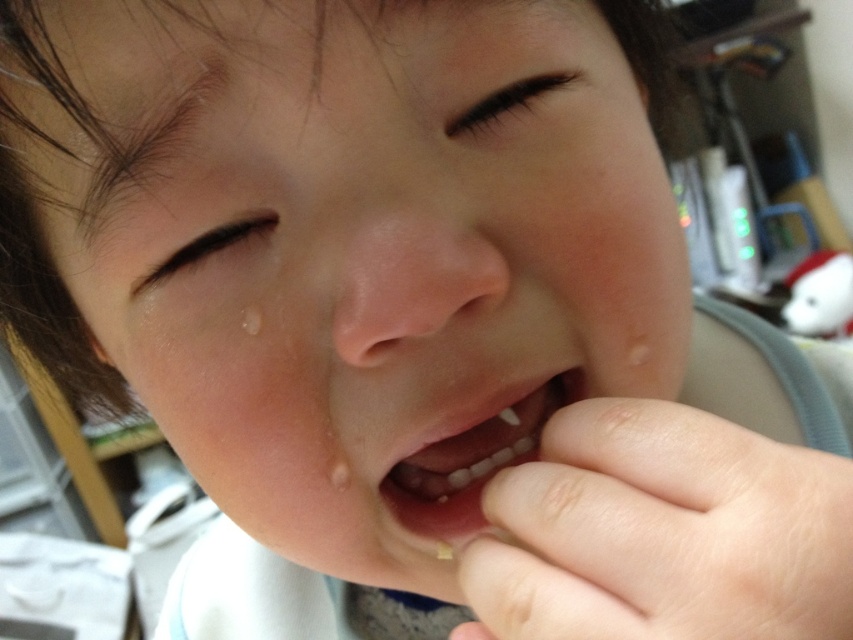
Question: Is pale skin hand at mouth bigger than pink flesh-colored teeth at center?

Choices:
 (A) yes
 (B) no

Answer: (A)

Question: Observing the image, what is the correct spatial positioning of pale skin hand at mouth in reference to pink flesh-colored teeth at center?

Choices:
 (A) left
 (B) right

Answer: (B)

Question: Does pale skin hand at mouth have a smaller size compared to pink flesh-colored teeth at center?

Choices:
 (A) yes
 (B) no

Answer: (B)

Question: Which point is farther to the camera?

Choices:
 (A) (491, 465)
 (B) (614, 502)

Answer: (A)

Question: Which object appears closest to the camera in this image?

Choices:
 (A) pale skin hand at mouth
 (B) pink flesh-colored teeth at center

Answer: (A)